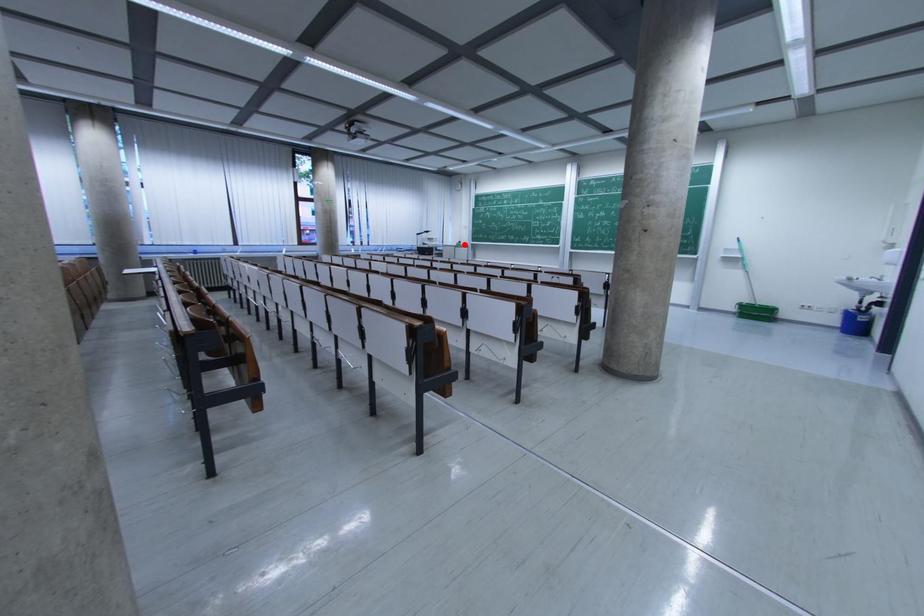
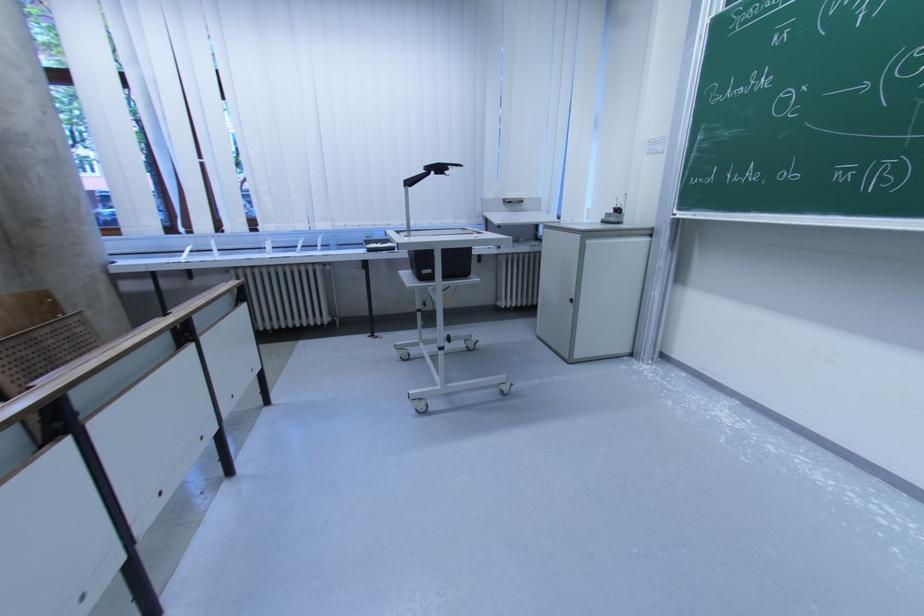
Locate, in the second image, the point that corresponds to the highlighted location in the first image.

(622, 213)